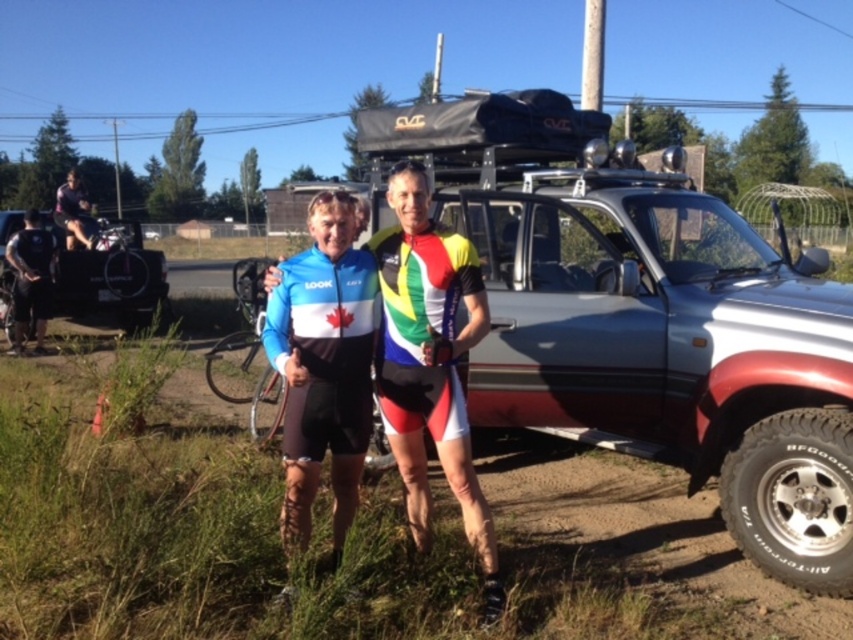
Is silver metallic pickup truck at center bigger than black matte uniform at left?

Yes.

From the picture: Can you confirm if silver metallic pickup truck at center is positioned to the left of black matte uniform at left?

In fact, silver metallic pickup truck at center is to the right of black matte uniform at left.

Who is more forward, (801,314) or (16,253)?

Point (801,314)

Find the location of a particular element. silver metallic pickup truck at center is located at coordinates (642, 317).

Does silver metallic pickup truck at center appear under blue matte cycling jersey at center?

Actually, silver metallic pickup truck at center is above blue matte cycling jersey at center.

Can you confirm if silver metallic pickup truck at center is taller than blue matte cycling jersey at center?

Correct, silver metallic pickup truck at center is much taller as blue matte cycling jersey at center.

Is point (712, 262) closer to camera compared to point (395, 253)?

No.

Locate an element on the screen. This screenshot has height=640, width=853. silver metallic pickup truck at center is located at coordinates 642,317.

Does brushed metal bicycle at left appear on the right side of black matte uniform at left?

Yes, brushed metal bicycle at left is to the right of black matte uniform at left.

Does brushed metal bicycle at left have a lesser height compared to black matte uniform at left?

No, brushed metal bicycle at left is not shorter than black matte uniform at left.

The width and height of the screenshot is (853, 640). What do you see at coordinates (108, 275) in the screenshot? I see `brushed metal bicycle at left` at bounding box center [108, 275].

Where is `brushed metal bicycle at left`? This screenshot has height=640, width=853. brushed metal bicycle at left is located at coordinates pyautogui.click(x=108, y=275).